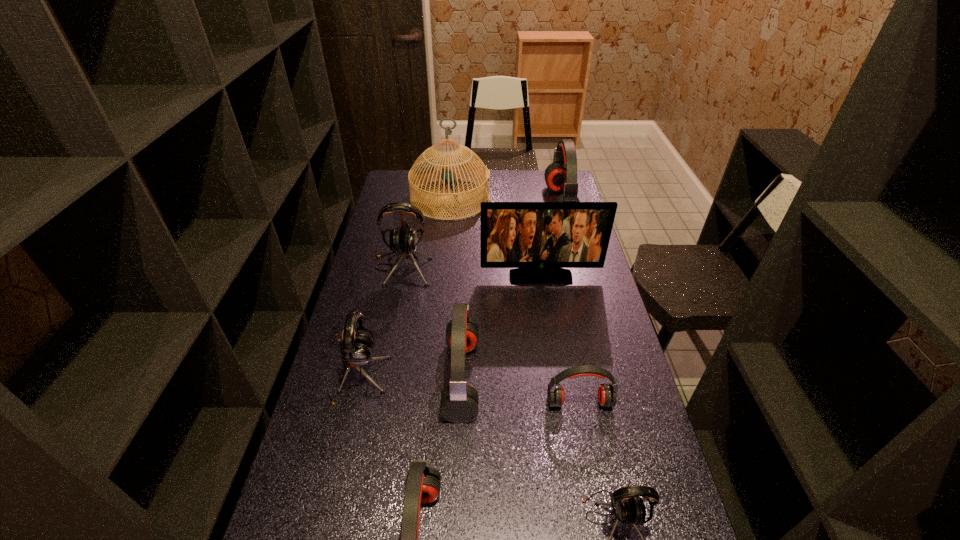
You are a GUI agent. You are given a task and a screenshot of the screen. Output one action in this format:
    pyautogui.click(x=<x>, y=<y>)
    Task: Click on the earphone that is at the far edge
    The image size is (960, 540).
    Given the screenshot: What is the action you would take?
    pyautogui.click(x=561, y=175)

Where is `birdcage present at the left edge`? The width and height of the screenshot is (960, 540). birdcage present at the left edge is located at coordinates (425, 166).

In order to click on monitor located at the right edge in this screenshot , I will do `click(539, 239)`.

The width and height of the screenshot is (960, 540). What are the coordinates of `object that is at the far left corner` in the screenshot? It's located at (425, 166).

Find the location of a particular element. The width and height of the screenshot is (960, 540). object that is at the far right corner is located at coordinates pyautogui.click(x=561, y=175).

Where is `vacant area at the left edge`? The width and height of the screenshot is (960, 540). vacant area at the left edge is located at coordinates (342, 329).

The height and width of the screenshot is (540, 960). In the image, there is a desktop. Find the location of `free space at the far left corner`. free space at the far left corner is located at coordinates (394, 182).

I want to click on vacant space in between the farthest black earphone and the shortest object, so click(491, 335).

You are a GUI agent. You are given a task and a screenshot of the screen. Output one action in this format:
    pyautogui.click(x=<x>, y=<y>)
    Task: Click on the vacant space that is in between the shortest object and the biggest red earphone
    This screenshot has height=540, width=960.
    Given the screenshot: What is the action you would take?
    pyautogui.click(x=570, y=303)

Select which object is the sixth closest to the farthest red earphone. Please provide its 2D coordinates. Your answer should be formatted as a tuple, i.e. [(x, y)], where the tuple contains the x and y coordinates of a point satisfying the conditions above.

[(357, 348)]